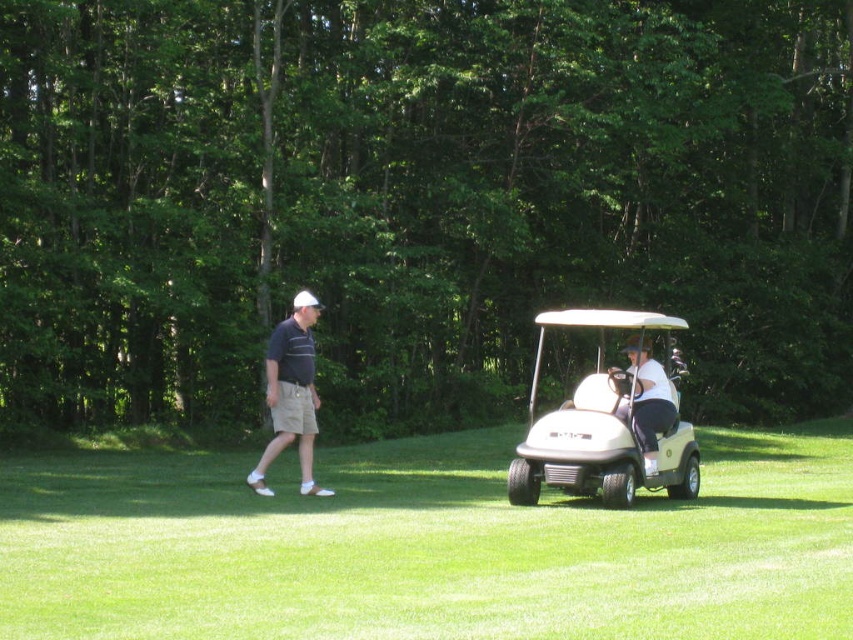
Question: Which object is positioned farthest from the matte black shirt at left?

Choices:
 (A) beige matte golf cart at right
 (B) white matte golf cart at center
 (C) light green plastic golf cart at center

Answer: (A)

Question: Does white matte golf cart at center appear on the right side of light green plastic golf cart at center?

Choices:
 (A) no
 (B) yes

Answer: (A)

Question: Is white matte golf cart at center wider than light green plastic golf cart at center?

Choices:
 (A) yes
 (B) no

Answer: (A)

Question: Which point is farther to the camera?

Choices:
 (A) white matte golf cart at center
 (B) light green plastic golf cart at center

Answer: (B)

Question: Which point is closer to the camera taking this photo?

Choices:
 (A) (560, 406)
 (B) (473, 554)
 (C) (624, 410)

Answer: (B)

Question: Is beige matte golf cart at right further to the viewer compared to matte black shirt at left?

Choices:
 (A) no
 (B) yes

Answer: (A)